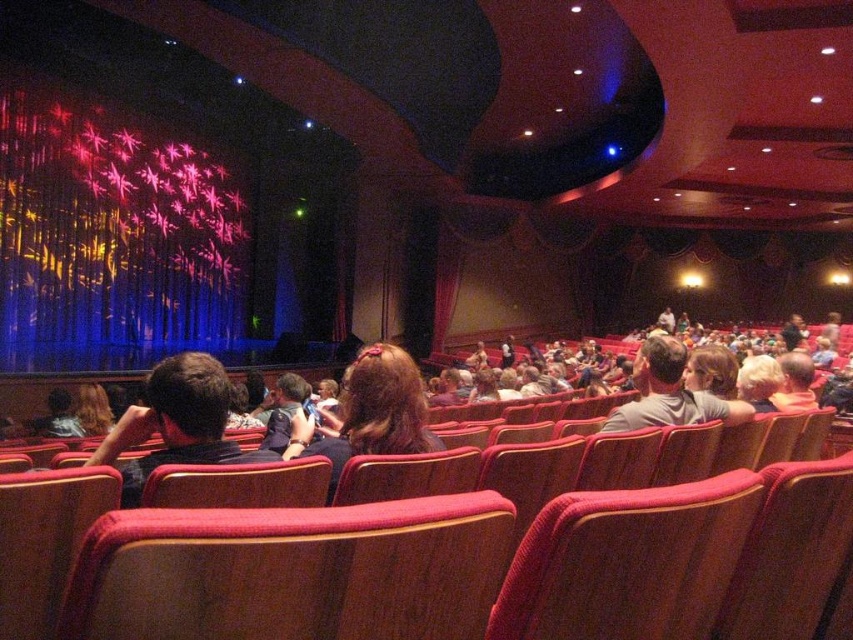
You are a stagehand needing to place a 1.2 meter wide decorative panel. You see the wooden seat at center and the matte black hair at center. Which object has enough width to accommodate the panel?

The wooden seat at center has a width that surpasses the matte black hair at center, so the wooden seat at center can accommodate the 1.2 meter wide decorative panel.

You are sitting in the theater and want to take a photo of the stage. The camera you have can only focus on objects within 1 meter. Is the point at coordinates point (152, 522) within the camera focus range?

The point at coordinates point (152, 522) is 99.31 centimeters from the camera. Since the camera can focus within 1 meter, the point is within the focus range.